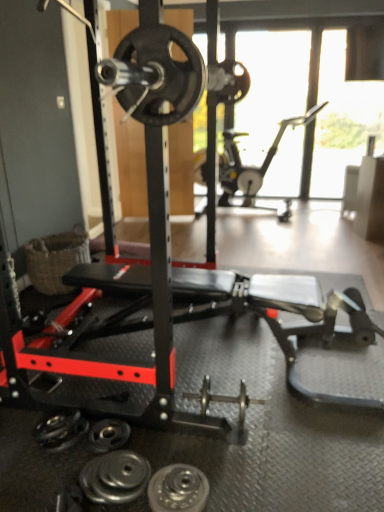
You are a GUI agent. You are given a task and a screenshot of the screen. Output one action in this format:
    pyautogui.click(x=<x>, y=<y>)
    Task: Click on the vacant space to the right of silver metallic weight plate at lower center, which appears as the 2th wheel when viewed from the left
    Image resolution: width=384 pixels, height=512 pixels.
    Given the screenshot: What is the action you would take?
    pyautogui.click(x=233, y=485)